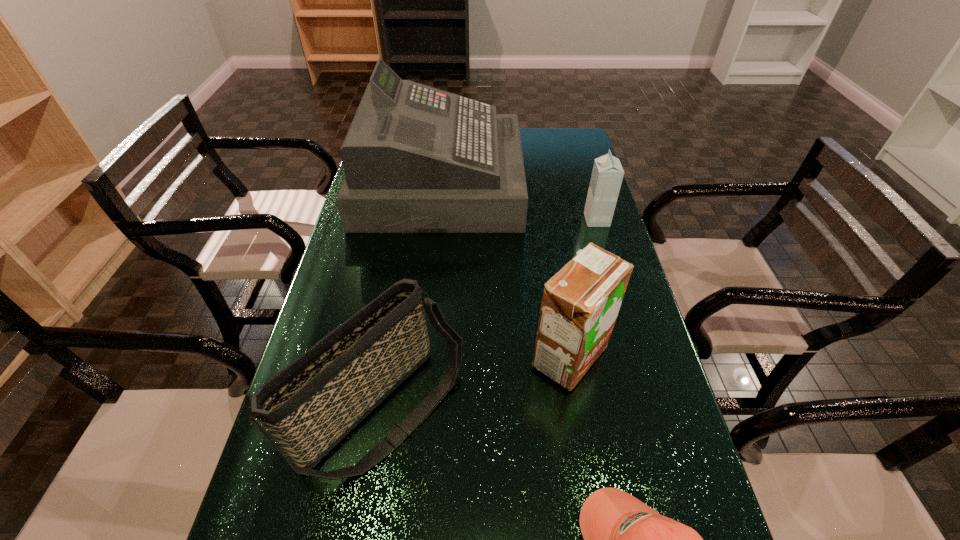
Where is `vacant area between the right carton and the handbag`? vacant area between the right carton and the handbag is located at coordinates (490, 315).

Locate an element on the screen. vacant area between the handbag and the shorter carton is located at coordinates (490, 315).

Identify the location of free spot between the nearer carton and the cash register. The height and width of the screenshot is (540, 960). (505, 271).

This screenshot has height=540, width=960. Identify the location of empty space that is in between the handbag and the farther carton. (490, 315).

At what (x,y) coordinates should I click in order to perform the action: click on free space between the nearer carton and the tallest object. Please return your answer as a coordinate pair (x, y). Looking at the image, I should click on (505, 271).

You are a GUI agent. You are given a task and a screenshot of the screen. Output one action in this format:
    pyautogui.click(x=<x>, y=<y>)
    Task: Click on the blank region between the handbag and the nearer carton
    Image resolution: width=960 pixels, height=540 pixels.
    Given the screenshot: What is the action you would take?
    pyautogui.click(x=475, y=383)

You are a GUI agent. You are given a task and a screenshot of the screen. Output one action in this format:
    pyautogui.click(x=<x>, y=<y>)
    Task: Click on the free spot between the farther carton and the handbag
    The image size is (960, 540).
    Given the screenshot: What is the action you would take?
    pyautogui.click(x=490, y=315)

Find the location of `object that is the fourth nearest to the baseball cap`. object that is the fourth nearest to the baseball cap is located at coordinates (607, 174).

Identify which object is the third closest to the tallest object. Please provide its 2D coordinates. Your answer should be formatted as a tuple, i.e. [(x, y)], where the tuple contains the x and y coordinates of a point satisfying the conditions above.

[(308, 407)]

What are the coordinates of `vacant space that satisfies the following two spatial constraints: 1. on the straw side of the taller carton; 2. on the front side of the handbag` in the screenshot? It's located at (578, 409).